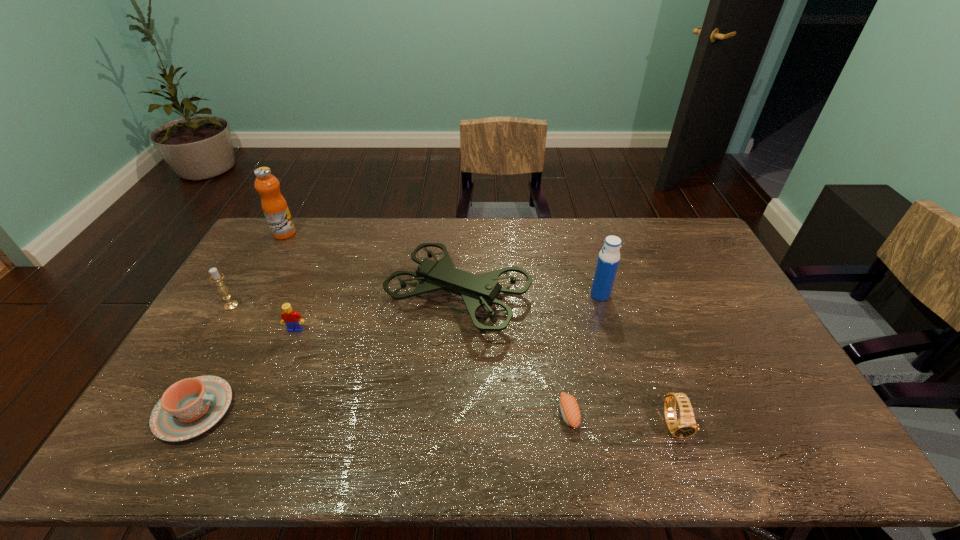
In order to click on free space that satisfies the following two spatial constraints: 1. on the back side of the candle holder; 2. on the left side of the tallest object in this screenshot , I will do `click(274, 233)`.